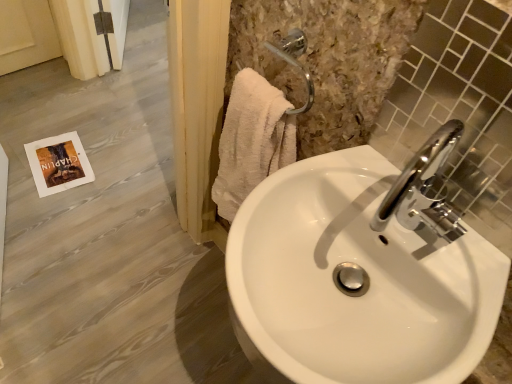
Question: From a real-world perspective, is chrome metallic faucet at upper right located higher than chrome metallic faucet at upper right?

Choices:
 (A) yes
 (B) no

Answer: (B)

Question: Considering the relative sizes of chrome metallic faucet at upper right and chrome metallic faucet at upper right in the image provided, is chrome metallic faucet at upper right bigger than chrome metallic faucet at upper right?

Choices:
 (A) yes
 (B) no

Answer: (B)

Question: Is chrome metallic faucet at upper right shorter than chrome metallic faucet at upper right?

Choices:
 (A) no
 (B) yes

Answer: (B)

Question: Can you confirm if chrome metallic faucet at upper right is positioned to the left of chrome metallic faucet at upper right?

Choices:
 (A) no
 (B) yes

Answer: (B)

Question: Does chrome metallic faucet at upper right have a smaller size compared to chrome metallic faucet at upper right?

Choices:
 (A) yes
 (B) no

Answer: (A)

Question: Does chrome metallic faucet at upper right lie behind chrome metallic faucet at upper right?

Choices:
 (A) no
 (B) yes

Answer: (B)

Question: Could white glossy sink at center be considered to be inside chrome metallic faucet at upper right?

Choices:
 (A) no
 (B) yes

Answer: (A)

Question: Does chrome metallic faucet at upper right have a greater height compared to white glossy sink at center?

Choices:
 (A) yes
 (B) no

Answer: (A)

Question: From a real-world perspective, is chrome metallic faucet at upper right under white glossy sink at center?

Choices:
 (A) yes
 (B) no

Answer: (B)

Question: Does chrome metallic faucet at upper right appear on the left side of white glossy sink at center?

Choices:
 (A) yes
 (B) no

Answer: (B)

Question: Can you confirm if chrome metallic faucet at upper right is smaller than white glossy sink at center?

Choices:
 (A) yes
 (B) no

Answer: (A)

Question: Is chrome metallic faucet at upper right aimed at white glossy sink at center?

Choices:
 (A) yes
 (B) no

Answer: (B)

Question: From the image's perspective, is chrome metallic faucet at upper right above white glossy sink at center?

Choices:
 (A) yes
 (B) no

Answer: (A)